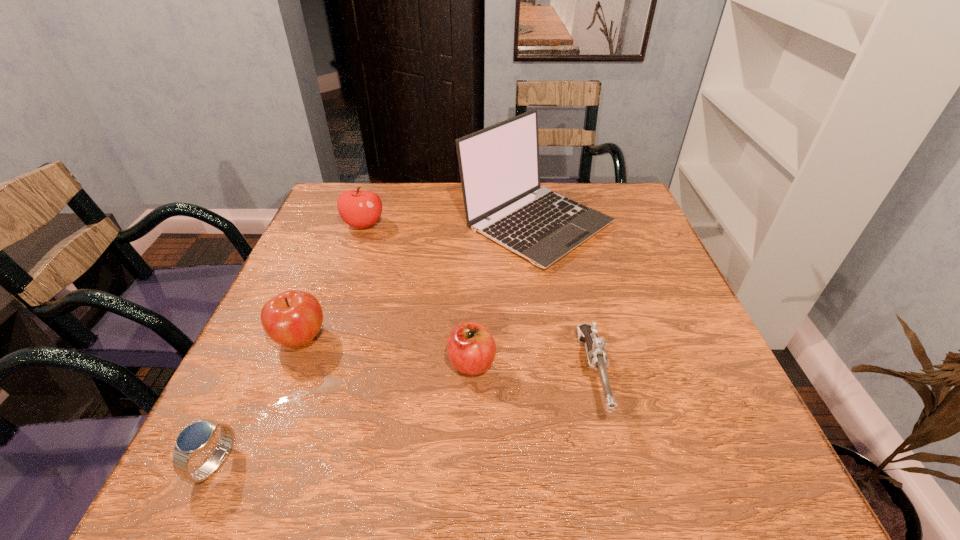
Locate an element on the screen. The height and width of the screenshot is (540, 960). free space at the left edge is located at coordinates (310, 261).

Where is `vacant region at the right edge`? vacant region at the right edge is located at coordinates (653, 419).

In the image, there is a desktop. Where is `vacant space at the far left corner`? This screenshot has width=960, height=540. vacant space at the far left corner is located at coordinates (338, 184).

The image size is (960, 540). In the image, there is a desktop. In order to click on vacant space at the near left corner in this screenshot , I will do `click(252, 447)`.

Where is `free space at the far right corner of the desktop`? This screenshot has height=540, width=960. free space at the far right corner of the desktop is located at coordinates (626, 208).

This screenshot has height=540, width=960. I want to click on blank area at the near right corner, so click(x=720, y=474).

The image size is (960, 540). Identify the location of free space between the farthest apple and the gun. pos(478,300).

Where is `vacant space that's between the farthest apple and the gun`? Image resolution: width=960 pixels, height=540 pixels. vacant space that's between the farthest apple and the gun is located at coordinates click(478, 300).

You are a GUI agent. You are given a task and a screenshot of the screen. Output one action in this format:
    pyautogui.click(x=<x>, y=<y>)
    Task: Click on the empty location between the laptop_computer and the nearest object
    
    Given the screenshot: What is the action you would take?
    pyautogui.click(x=375, y=343)

Find the location of a particular element. The width and height of the screenshot is (960, 540). free space between the farthest apple and the laptop_computer is located at coordinates (449, 224).